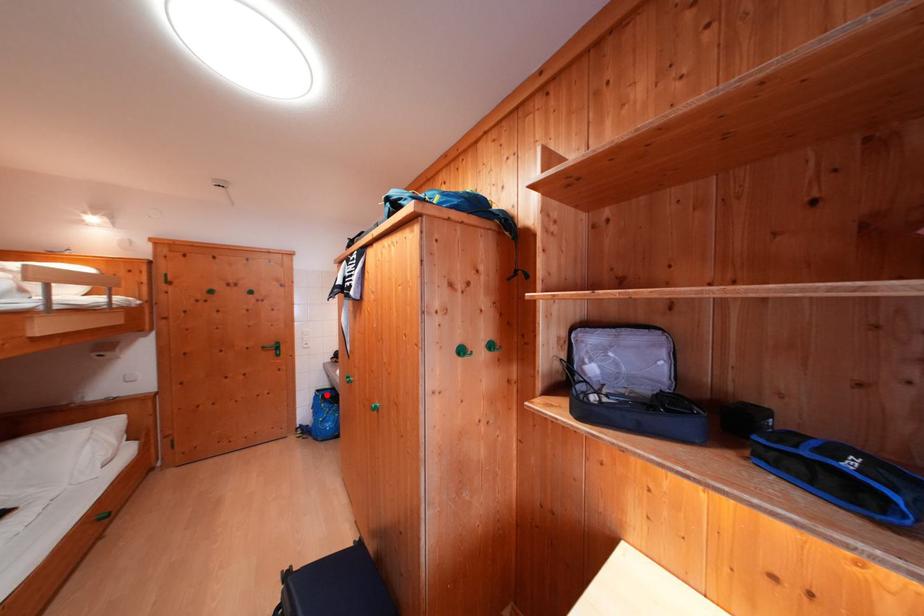
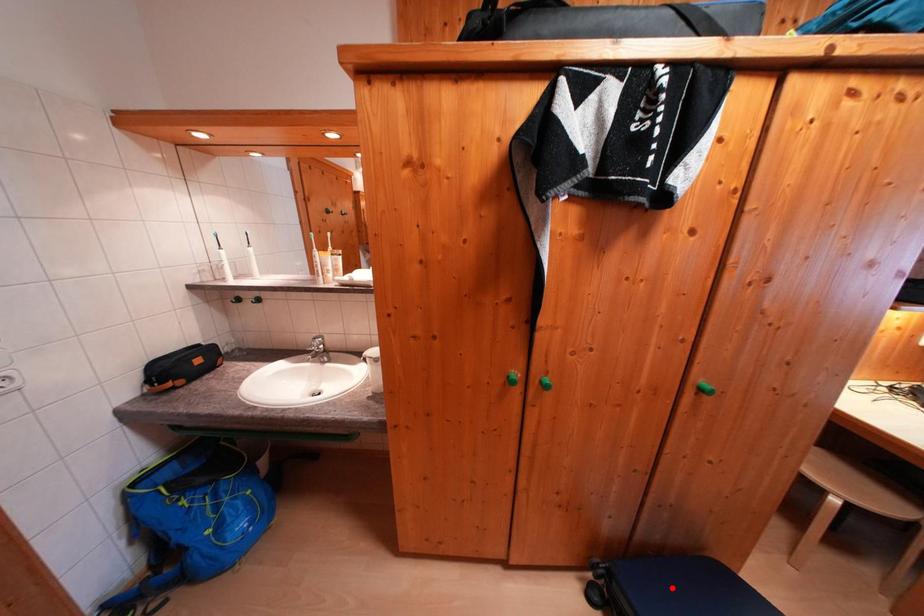
I am providing you with two images of the same scene from different viewpoints. A red point is marked on the first image and another point is marked on the second image. Is the marked point in image1 the same physical position as the marked point in image2?

No